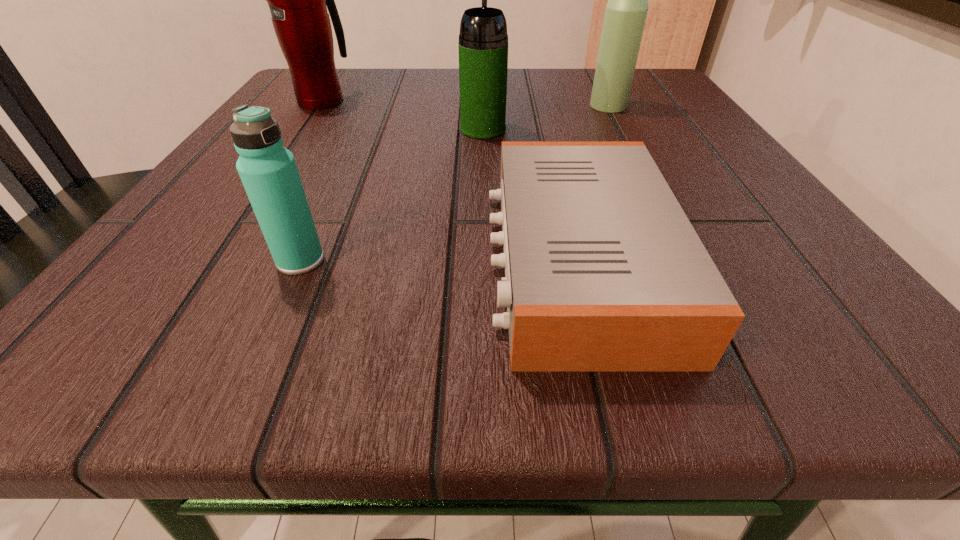
Locate an element on the screen. vacant area that lies between the radio receiver and the leftmost thermos bottle is located at coordinates (450, 181).

Where is `free area in between the third thermos bottle from right to left and the shortest object`? The height and width of the screenshot is (540, 960). free area in between the third thermos bottle from right to left and the shortest object is located at coordinates (439, 261).

Where is `vacant space that is in between the third thermos bottle from left to right and the shortest thermos bottle`? The image size is (960, 540). vacant space that is in between the third thermos bottle from left to right and the shortest thermos bottle is located at coordinates (392, 195).

Where is `free space between the fourth object from right to left and the leftmost object`? free space between the fourth object from right to left and the leftmost object is located at coordinates (312, 180).

Select which object is the third closest to the second thermos bottle from left to right. Please provide its 2D coordinates. Your answer should be formatted as a tuple, i.e. [(x, y)], where the tuple contains the x and y coordinates of a point satisfying the conditions above.

[(297, 0)]

Select which object appears as the second closest to the shortest object. Please provide its 2D coordinates. Your answer should be formatted as a tuple, i.e. [(x, y)], where the tuple contains the x and y coordinates of a point satisfying the conditions above.

[(268, 171)]

Select which thermos bottle is the second closest to the second thermos bottle from right to left. Please provide its 2D coordinates. Your answer should be formatted as a tuple, i.e. [(x, y)], where the tuple contains the x and y coordinates of a point satisfying the conditions above.

[(297, 0)]

At what (x,y) coordinates should I click in order to perform the action: click on thermos bottle that is the second closest one to the shortest object. Please return your answer as a coordinate pair (x, y). This screenshot has height=540, width=960. Looking at the image, I should click on 268,171.

Locate an element on the screen. vacant space that satisfies the following two spatial constraints: 1. from the spout of the rightmost thermos bottle; 2. on the right side of the third farthest object is located at coordinates (483, 106).

I want to click on blank space that satisfies the following two spatial constraints: 1. from the spout of the rightmost thermos bottle; 2. on the left side of the second nearest thermos bottle, so click(x=483, y=106).